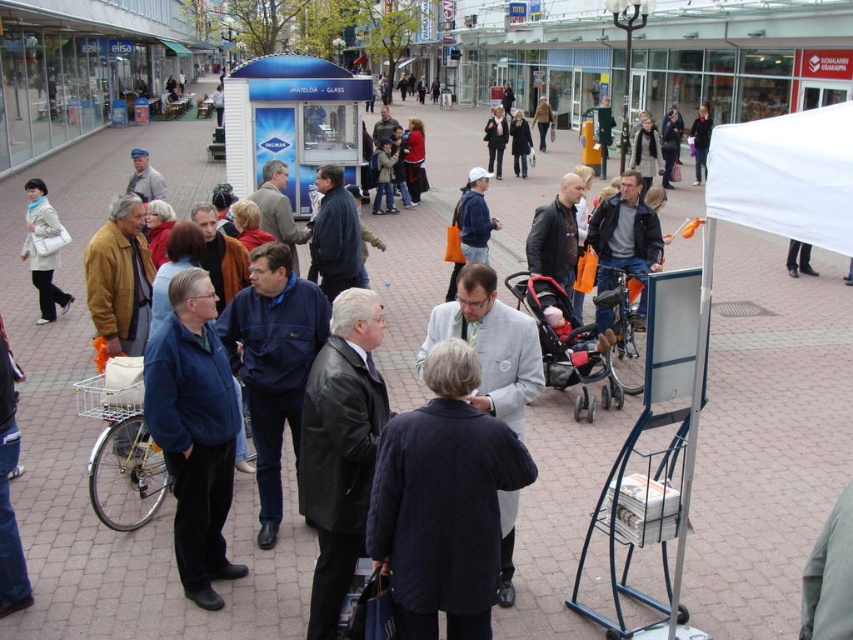
You are a photographer standing in the bustling outdoor scene. You want to take a photo that includes both the black leather jacket at center and the matte white bag at left. Which object should you focus on first to ensure both are in frame?

Since the black leather jacket at center is taller than the matte white bag at left, you should focus on the black leather jacket at center first to ensure both are in frame.

You are standing at point [47,202] and want to walk to the stand where the group is gathered. Is the stand closer to you or further away compared to point [375,332]?

The stand is closer to you than point [375,332] because point [375,332] is in front of point [47,202], meaning the stand is located between you and that point.

You are standing at the edge of the bustling outdoor scene. There is a red fabric baby carriage at center. Can you reach it without moving more than 7 meters?

The red fabric baby carriage at center is 7.17 meters from viewer. Since it is slightly farther than 7 meters, you cannot reach it without moving more than 7 meters.